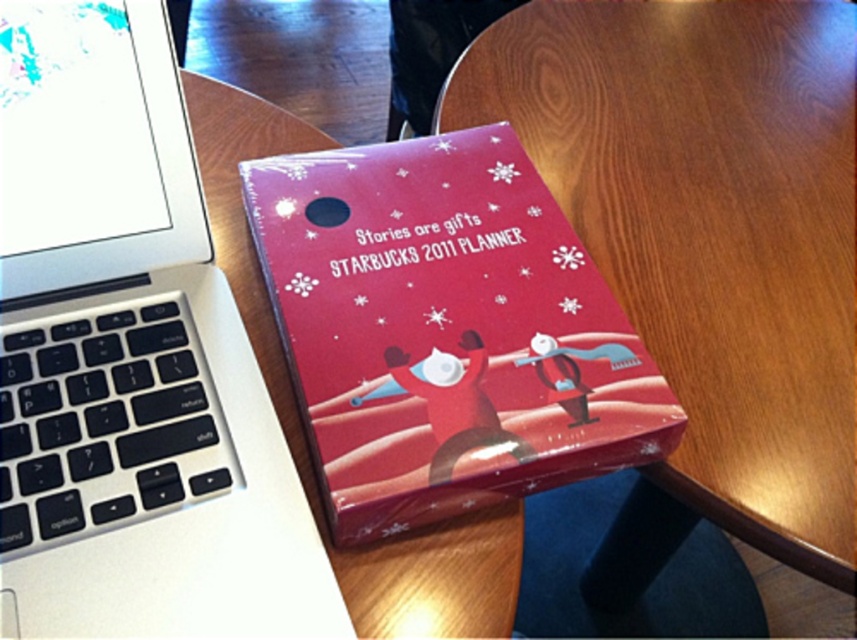
Is wooden at center wider than matte red planner at center?

Yes, wooden at center is wider than matte red planner at center.

This screenshot has width=857, height=640. What do you see at coordinates (709, 228) in the screenshot? I see `wooden at center` at bounding box center [709, 228].

The height and width of the screenshot is (640, 857). In order to click on wooden at center in this screenshot , I will do `click(709, 228)`.

Between point (178, 340) and point (639, 458), which one is positioned in front?

Positioned in front is point (639, 458).

Measure the distance between sleek silver laptop at upper left and camera.

sleek silver laptop at upper left and camera are 34.24 centimeters apart.

Between point (81, 227) and point (387, 250), which one is positioned behind?

The point (387, 250) is behind.

Identify the location of sleek silver laptop at upper left. Image resolution: width=857 pixels, height=640 pixels. (129, 358).

Can you confirm if sleek silver laptop at upper left is positioned above wooden at center?

Incorrect, sleek silver laptop at upper left is not positioned above wooden at center.

Between sleek silver laptop at upper left and wooden at center, which one is positioned higher?

wooden at center is higher up.

Between point (222, 572) and point (795, 157), which one is positioned in front?

Positioned in front is point (222, 572).

Identify the location of sleek silver laptop at upper left. The image size is (857, 640). (129, 358).